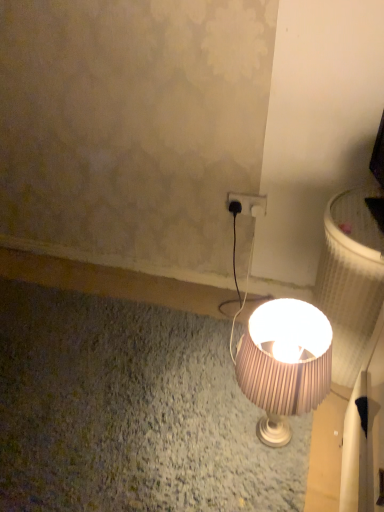
Question: From the image's perspective, would you say black plastic power plug at upper right is shown under black plastic plug at center?

Choices:
 (A) no
 (B) yes

Answer: (A)

Question: Is black plastic power plug at upper right shorter than black plastic plug at center?

Choices:
 (A) yes
 (B) no

Answer: (B)

Question: Could you tell me if black plastic power plug at upper right is facing black plastic plug at center?

Choices:
 (A) yes
 (B) no

Answer: (A)

Question: Could black plastic plug at center be considered to be inside black plastic power plug at upper right?

Choices:
 (A) yes
 (B) no

Answer: (B)

Question: Is black plastic power plug at upper right to the left of black plastic plug at center from the viewer's perspective?

Choices:
 (A) no
 (B) yes

Answer: (A)

Question: Does black plastic power plug at upper right come behind black plastic plug at center?

Choices:
 (A) yes
 (B) no

Answer: (B)

Question: Would you say black plastic plug at center contains black plastic power plug at upper right?

Choices:
 (A) yes
 (B) no

Answer: (B)

Question: Does black plastic plug at center have a larger size compared to black plastic power plug at upper right?

Choices:
 (A) yes
 (B) no

Answer: (B)

Question: Considering the relative positions of black plastic plug at center and black plastic power plug at upper right in the image provided, is black plastic plug at center to the right of black plastic power plug at upper right from the viewer's perspective?

Choices:
 (A) no
 (B) yes

Answer: (A)

Question: Can you confirm if black plastic plug at center is wider than black plastic power plug at upper right?

Choices:
 (A) no
 (B) yes

Answer: (B)

Question: From a real-world perspective, is black plastic plug at center beneath black plastic power plug at upper right?

Choices:
 (A) yes
 (B) no

Answer: (A)

Question: Does black plastic plug at center have a greater height compared to black plastic power plug at upper right?

Choices:
 (A) no
 (B) yes

Answer: (A)

Question: From the image's perspective, is matte brown lampshade at center beneath black plastic plug at center?

Choices:
 (A) no
 (B) yes

Answer: (B)